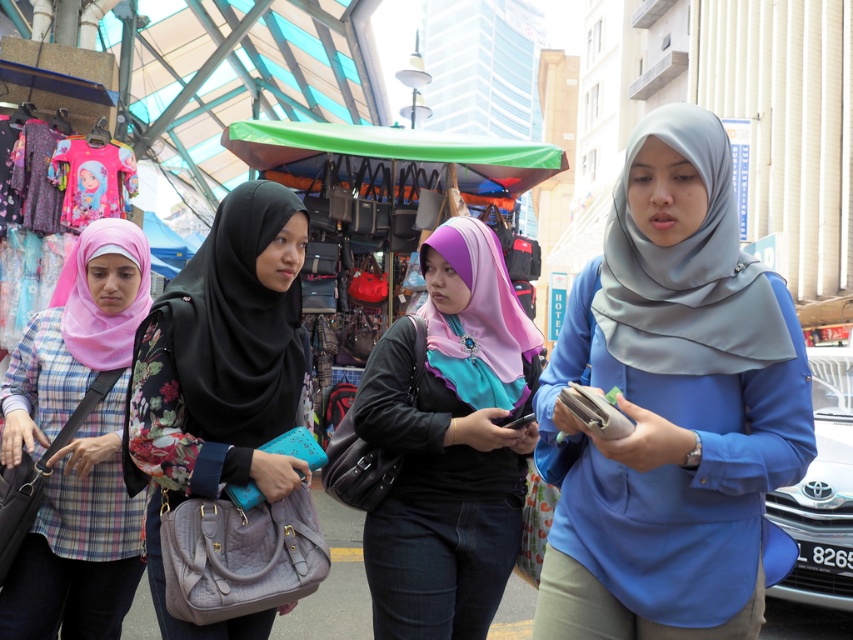
Question: Among these objects, which one is nearest to the camera?

Choices:
 (A) matte black hijab at center
 (B) matte pink hijab at left
 (C) purple satin hijab at center
 (D) matte gray hijab at center

Answer: (D)

Question: Is matte gray hijab at center positioned at the back of matte black hijab at center?

Choices:
 (A) no
 (B) yes

Answer: (A)

Question: Estimate the real-world distances between objects in this image. Which object is closer to the purple satin hijab at center?

Choices:
 (A) matte pink hijab at left
 (B) matte black hijab at center

Answer: (B)

Question: Can you confirm if purple satin hijab at center is positioned above matte black hijab at center?

Choices:
 (A) yes
 (B) no

Answer: (B)

Question: Does matte gray hijab at center have a smaller size compared to matte black hijab at center?

Choices:
 (A) no
 (B) yes

Answer: (A)

Question: Among these points, which one is farthest from the camera?

Choices:
 (A) (270, 346)
 (B) (76, 512)

Answer: (B)